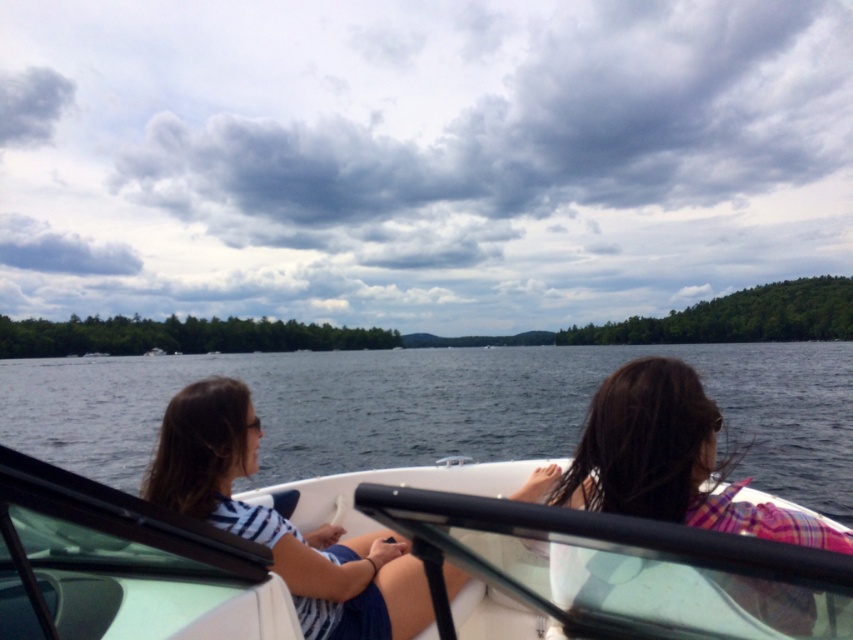
Question: Does plaid fabric hair at center have a lesser width compared to striped fabric shirt at left?

Choices:
 (A) yes
 (B) no

Answer: (A)

Question: Which of the following is the closest to the observer?

Choices:
 (A) plaid fabric hair at center
 (B) striped fabric shirt at left
 (C) white glossy boat at center
 (D) clear water at center

Answer: (A)

Question: From the image, what is the correct spatial relationship of white glossy boat at center in relation to plaid fabric hair at center?

Choices:
 (A) right
 (B) left

Answer: (B)

Question: Which object is farther from the camera taking this photo?

Choices:
 (A) clear water at center
 (B) striped fabric shirt at left

Answer: (A)

Question: Is white glossy boat at center below clear water at center?

Choices:
 (A) no
 (B) yes

Answer: (A)

Question: Which of the following is the closest to the observer?

Choices:
 (A) clear water at center
 (B) striped fabric shirt at left

Answer: (B)